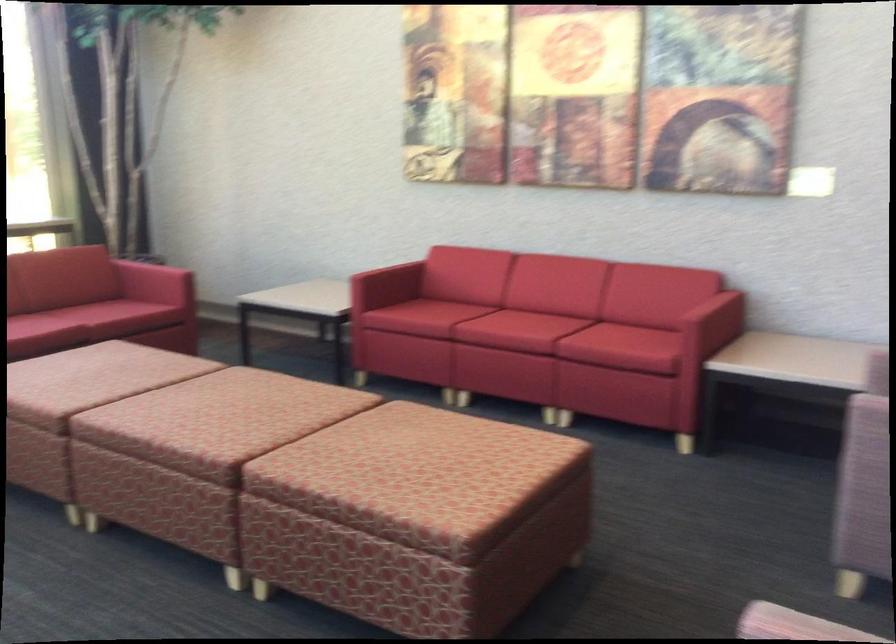
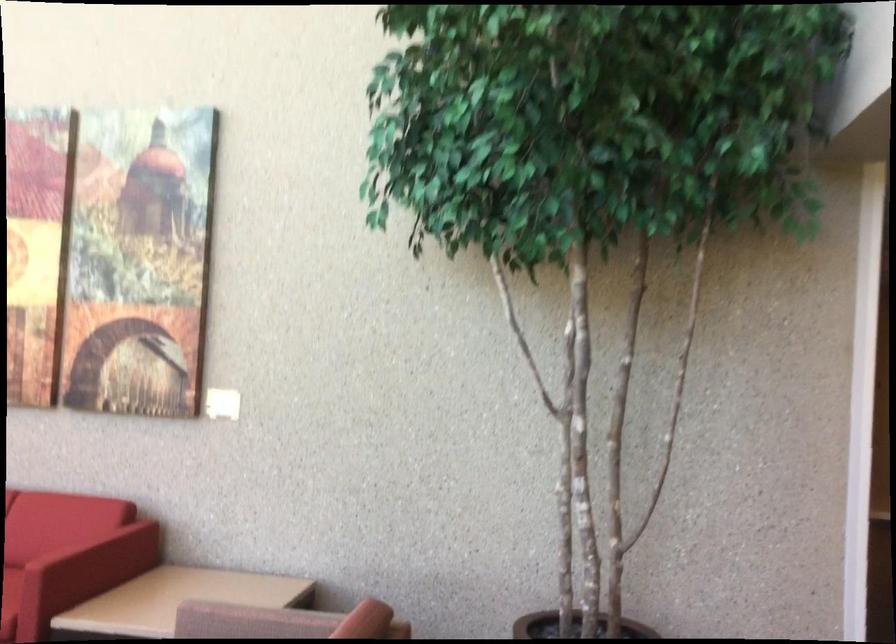
Locate, in the second image, the point that corresponds to (x=685, y=301) in the first image.

(80, 540)